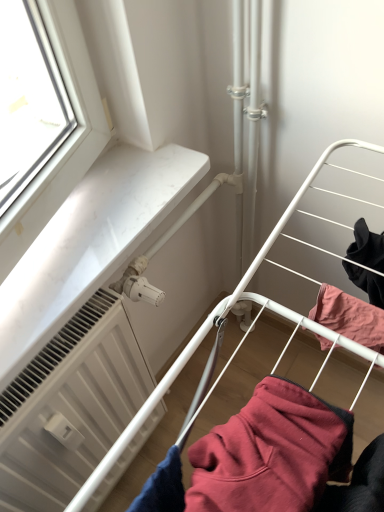
Question: Is point (278, 445) closer or farther from the camera than point (107, 406)?

Choices:
 (A) closer
 (B) farther

Answer: (A)

Question: From a real-world perspective, is maroon fleece sweatshirt at center above or below white matte radiator at lower left?

Choices:
 (A) above
 (B) below

Answer: (A)

Question: Is maroon fleece sweatshirt at center situated inside white matte radiator at lower left or outside?

Choices:
 (A) outside
 (B) inside

Answer: (A)

Question: In terms of width, does white matte radiator at lower left look wider or thinner when compared to maroon fleece sweatshirt at center?

Choices:
 (A) wide
 (B) thin

Answer: (B)

Question: Based on their positions, is white matte radiator at lower left located to the left or right of maroon fleece sweatshirt at center?

Choices:
 (A) left
 (B) right

Answer: (A)

Question: Is white matte radiator at lower left in front of or behind maroon fleece sweatshirt at center in the image?

Choices:
 (A) front
 (B) behind

Answer: (B)

Question: Is point (18, 402) closer or farther from the camera than point (299, 392)?

Choices:
 (A) closer
 (B) farther

Answer: (B)